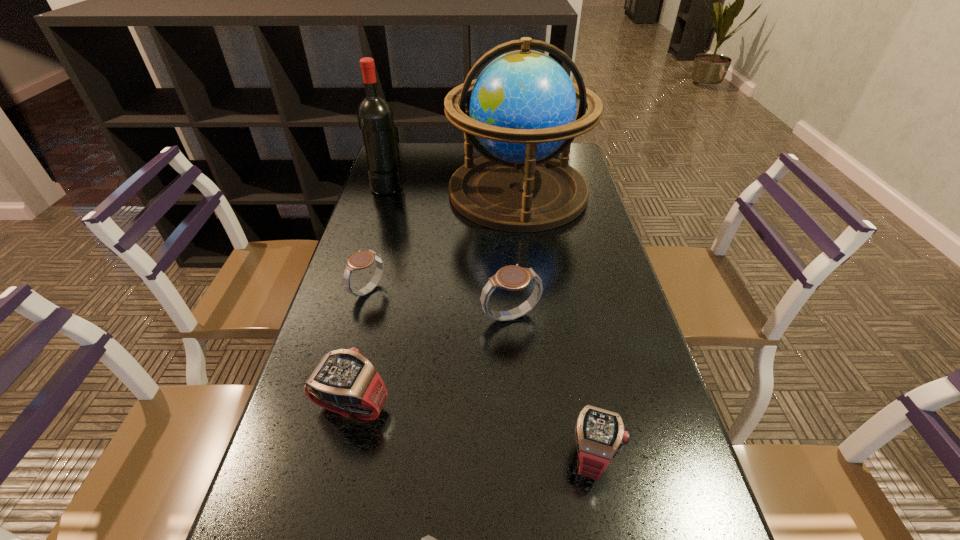
Identify the location of blank space located on the right of the biggest gray watch. Image resolution: width=960 pixels, height=540 pixels. (604, 316).

The image size is (960, 540). I want to click on free spot located on the front of the left red watch, so click(x=340, y=457).

Identify the location of vacant space located 0.260m on the back of the second biggest gray watch. [x=387, y=220].

Locate an element on the screen. The image size is (960, 540). vacant area situated 0.400m on the back of the smaller red watch is located at coordinates point(560,282).

Locate an element on the screen. The width and height of the screenshot is (960, 540). object that is at the far edge is located at coordinates (522, 107).

You are a GUI agent. You are given a task and a screenshot of the screen. Output one action in this format:
    pyautogui.click(x=<x>, y=<y>)
    Task: Click on the wine bottle that is at the left edge
    The image size is (960, 540).
    Given the screenshot: What is the action you would take?
    pyautogui.click(x=375, y=116)

The image size is (960, 540). What are the coordinates of `globe that is at the right edge` in the screenshot? It's located at (522, 107).

Locate an element on the screen. The image size is (960, 540). watch located in the right edge section of the desktop is located at coordinates (600, 434).

Identify the location of object present at the far right corner. This screenshot has width=960, height=540. (522, 107).

This screenshot has width=960, height=540. In the image, there is a desktop. Find the location of `free region at the left edge`. free region at the left edge is located at coordinates click(296, 416).